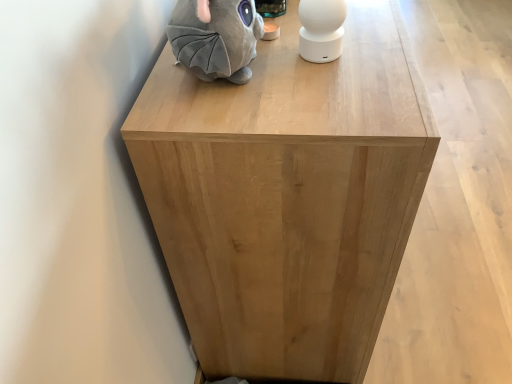
This screenshot has width=512, height=384. Identify the location of vacant space behind white matte speaker at upper center, which is counted as the first toy, starting from the right. (342, 25).